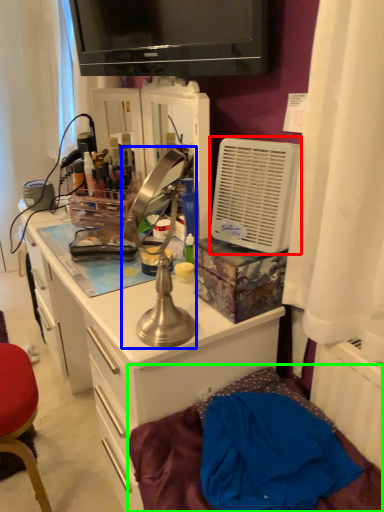
Question: Which is nearer to the air conditioning (highlighted by a red box)? table lamp (highlighted by a blue box) or bed (highlighted by a green box).

Choices:
 (A) table lamp
 (B) bed

Answer: (A)